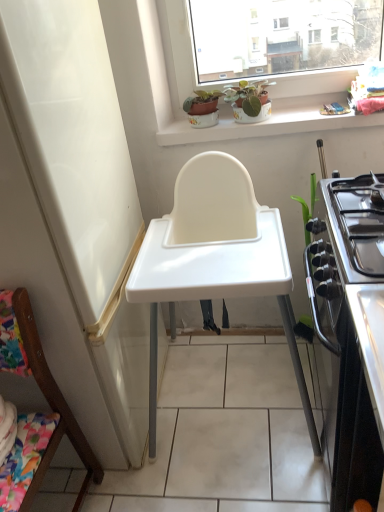
You are a GUI agent. You are given a task and a screenshot of the screen. Output one action in this format:
    pyautogui.click(x=<x>, y=<y>)
    Task: Click on the white plastic highchair at center
    The image size is (384, 512).
    Given the screenshot: What is the action you would take?
    pyautogui.click(x=216, y=288)

Describe the element at coordinates (203, 108) in the screenshot. I see `matte ceramic pot at upper center, which ranks as the first houseplant in left-to-right order` at that location.

Measure the distance between stainless steel stove at right and camera.

The distance of stainless steel stove at right from camera is 29.24 inches.

Describe the element at coordinates (269, 122) in the screenshot. The image size is (384, 512). I see `white ceramic window sill at upper center` at that location.

This screenshot has height=512, width=384. What do you see at coordinates (46, 396) in the screenshot? I see `wooden chair at lower left` at bounding box center [46, 396].

Where is `green matte plant at upper center, acting as the 2th houseplant starting from the left`? The image size is (384, 512). green matte plant at upper center, acting as the 2th houseplant starting from the left is located at coordinates (249, 101).

Is matte ceramic pot at upper center, which ranks as the first houseplant in left-to-right order, facing away from stainless steel stove at right?

matte ceramic pot at upper center, which ranks as the first houseplant in left-to-right order, does not have its back to stainless steel stove at right.

From the picture: Considering the sizes of objects matte ceramic pot at upper center, which ranks as the first houseplant in left-to-right order, and stainless steel stove at right in the image provided, who is taller, matte ceramic pot at upper center, which ranks as the first houseplant in left-to-right order, or stainless steel stove at right?

Standing taller between the two is stainless steel stove at right.

Does matte ceramic pot at upper center, which ranks as the first houseplant in left-to-right order, have a larger size compared to stainless steel stove at right?

Actually, matte ceramic pot at upper center, which ranks as the first houseplant in left-to-right order, might be smaller than stainless steel stove at right.

Based on the photo, from the image's perspective, which one is positioned lower, wooden chair at lower left or white ceramic window sill at upper center?

From the image's view, wooden chair at lower left is below.

Considering the sizes of objects wooden chair at lower left and white ceramic window sill at upper center in the image provided, who is shorter, wooden chair at lower left or white ceramic window sill at upper center?

white ceramic window sill at upper center is shorter.

You are a GUI agent. You are given a task and a screenshot of the screen. Output one action in this format:
    pyautogui.click(x=<x>, y=<y>)
    Task: Click on the window sill above the wooden chair at lower left (from the image's perspective)
    
    Given the screenshot: What is the action you would take?
    pyautogui.click(x=269, y=122)

Could you tell me if white plastic highchair at center is turned towards stainless steel stove at right?

No, white plastic highchair at center does not turn towards stainless steel stove at right.

Can you confirm if white plastic highchair at center is taller than stainless steel stove at right?

Indeed, white plastic highchair at center has a greater height compared to stainless steel stove at right.

Find the location of a particular element. appliance in front of the white plastic highchair at center is located at coordinates (351, 330).

Which of these two, white plastic highchair at center or stainless steel stove at right, is bigger?

white plastic highchair at center.

Which of these two, white plastic highchair at center or matte ceramic pot at upper center, which ranks as the first houseplant in left-to-right order, stands taller?

Standing taller between the two is white plastic highchair at center.

Is point (311, 418) positioned behind point (218, 92)?

No.

Is the depth of white plastic highchair at center greater than that of matte ceramic pot at upper center, which ranks as the first houseplant in left-to-right order?

That is False.

What are the coordinates of `table in front of the matte ceramic pot at upper center, marked as the 2th houseplant in a right-to-left arrangement` in the screenshot? It's located at (216, 288).

How many degrees apart are the facing directions of wooden chair at lower left and stainless steel stove at right?

wooden chair at lower left and stainless steel stove at right are facing 91.8 degrees away from each other.

Is point (44, 464) in front of point (366, 462)?

No, it is behind (366, 462).

From a real-world perspective, does wooden chair at lower left stand above stainless steel stove at right?

Indeed, from a real-world perspective, wooden chair at lower left stands above stainless steel stove at right.

Considering the relative sizes of wooden chair at lower left and stainless steel stove at right in the image provided, is wooden chair at lower left smaller than stainless steel stove at right?

Yes, wooden chair at lower left is smaller than stainless steel stove at right.

How distant is green matte plant at upper center, marked as the 1th houseplant in a right-to-left arrangement, from matte ceramic pot at upper center, which ranks as the first houseplant in left-to-right order?

The distance of green matte plant at upper center, marked as the 1th houseplant in a right-to-left arrangement, from matte ceramic pot at upper center, which ranks as the first houseplant in left-to-right order, is 4.88 inches.

Is matte ceramic pot at upper center, marked as the 2th houseplant in a right-to-left arrangement, at the back of green matte plant at upper center, marked as the 1th houseplant in a right-to-left arrangement?

green matte plant at upper center, marked as the 1th houseplant in a right-to-left arrangement, does not have its back to matte ceramic pot at upper center, marked as the 2th houseplant in a right-to-left arrangement.

Does green matte plant at upper center, acting as the 2th houseplant starting from the left, appear on the right side of matte ceramic pot at upper center, marked as the 2th houseplant in a right-to-left arrangement?

Indeed, green matte plant at upper center, acting as the 2th houseplant starting from the left, is positioned on the right side of matte ceramic pot at upper center, marked as the 2th houseplant in a right-to-left arrangement.

Is green matte plant at upper center, marked as the 1th houseplant in a right-to-left arrangement, turned away from stainless steel stove at right?

That's not correct — green matte plant at upper center, marked as the 1th houseplant in a right-to-left arrangement, is not looking away from stainless steel stove at right.

Does green matte plant at upper center, acting as the 2th houseplant starting from the left, have a greater height compared to stainless steel stove at right?

Incorrect, the height of green matte plant at upper center, acting as the 2th houseplant starting from the left, is not larger of that of stainless steel stove at right.

Considering the sizes of objects green matte plant at upper center, acting as the 2th houseplant starting from the left, and stainless steel stove at right in the image provided, who is bigger, green matte plant at upper center, acting as the 2th houseplant starting from the left, or stainless steel stove at right?

stainless steel stove at right is bigger.

Between green matte plant at upper center, marked as the 1th houseplant in a right-to-left arrangement, and stainless steel stove at right, which one has larger width?

Wider between the two is stainless steel stove at right.

From the image's perspective, count 2nd houseplants upward from the stainless steel stove at right and point to it. Please provide its 2D coordinates.

[(203, 108)]

You are a GUI agent. You are given a task and a screenshot of the screen. Output one action in this format:
    pyautogui.click(x=<x>, y=<y>)
    Task: Click on the chair beneath the white ceramic window sill at upper center (from a real-world perspective)
    
    Given the screenshot: What is the action you would take?
    pyautogui.click(x=46, y=396)

Estimate the real-world distances between objects in this image. Which object is further from stainless steel stove at right, green matte plant at upper center, marked as the 1th houseplant in a right-to-left arrangement, or white ceramic window sill at upper center?

green matte plant at upper center, marked as the 1th houseplant in a right-to-left arrangement, is positioned further to the anchor stainless steel stove at right.

Looking at the image, which one is located further to white ceramic window sill at upper center, matte ceramic pot at upper center, which ranks as the first houseplant in left-to-right order, or wooden chair at lower left?

wooden chair at lower left is further to white ceramic window sill at upper center.

Based on their spatial positions, is white plastic highchair at center or wooden chair at lower left closer to stainless steel stove at right?

Based on the image, white plastic highchair at center appears to be nearer to stainless steel stove at right.

Which object lies further to the anchor point stainless steel stove at right, green matte plant at upper center, marked as the 1th houseplant in a right-to-left arrangement, or white plastic highchair at center?

The object further to stainless steel stove at right is green matte plant at upper center, marked as the 1th houseplant in a right-to-left arrangement.

From the picture: Based on their spatial positions, is matte ceramic pot at upper center, marked as the 2th houseplant in a right-to-left arrangement, or white ceramic window sill at upper center closer to white plastic highchair at center?

white ceramic window sill at upper center.

Based on their spatial positions, is white ceramic window sill at upper center or stainless steel stove at right closer to wooden chair at lower left?

Among the two, stainless steel stove at right is located nearer to wooden chair at lower left.

When comparing their distances from white ceramic window sill at upper center, does green matte plant at upper center, acting as the 2th houseplant starting from the left, or wooden chair at lower left seem further?

wooden chair at lower left is further to white ceramic window sill at upper center.

Which object lies further to the anchor point stainless steel stove at right, white ceramic window sill at upper center or matte ceramic pot at upper center, marked as the 2th houseplant in a right-to-left arrangement?

Among the two, matte ceramic pot at upper center, marked as the 2th houseplant in a right-to-left arrangement, is located further to stainless steel stove at right.

In order to click on table between white ceramic window sill at upper center and wooden chair at lower left in the vertical direction in this screenshot , I will do `click(216, 288)`.

In order to click on window sill that lies between matte ceramic pot at upper center, which ranks as the first houseplant in left-to-right order, and stainless steel stove at right from top to bottom in this screenshot , I will do `click(269, 122)`.

In order to click on table located between wooden chair at lower left and stainless steel stove at right in the left-right direction in this screenshot , I will do `click(216, 288)`.

Locate an element on the screen. The image size is (384, 512). appliance between green matte plant at upper center, marked as the 1th houseplant in a right-to-left arrangement, and wooden chair at lower left from top to bottom is located at coordinates (351, 330).